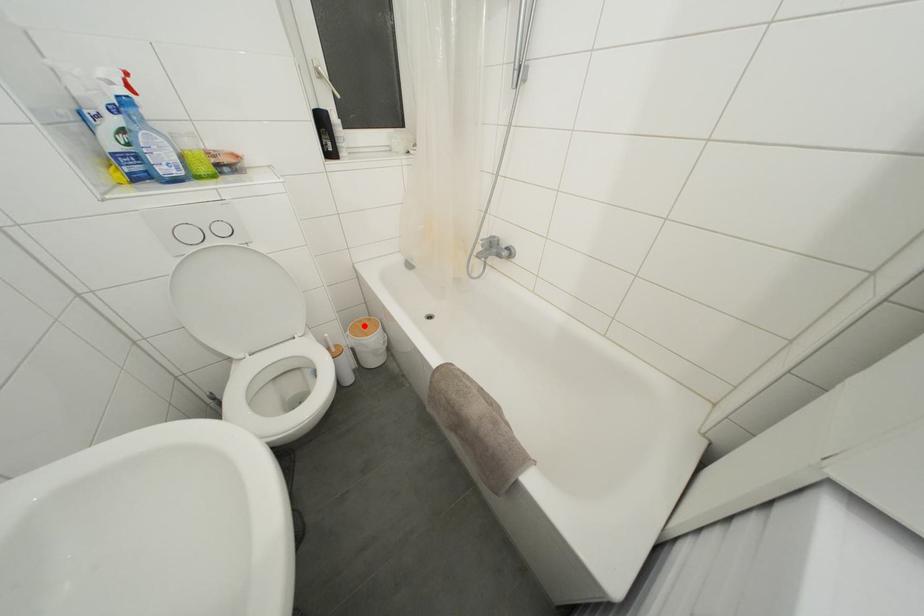
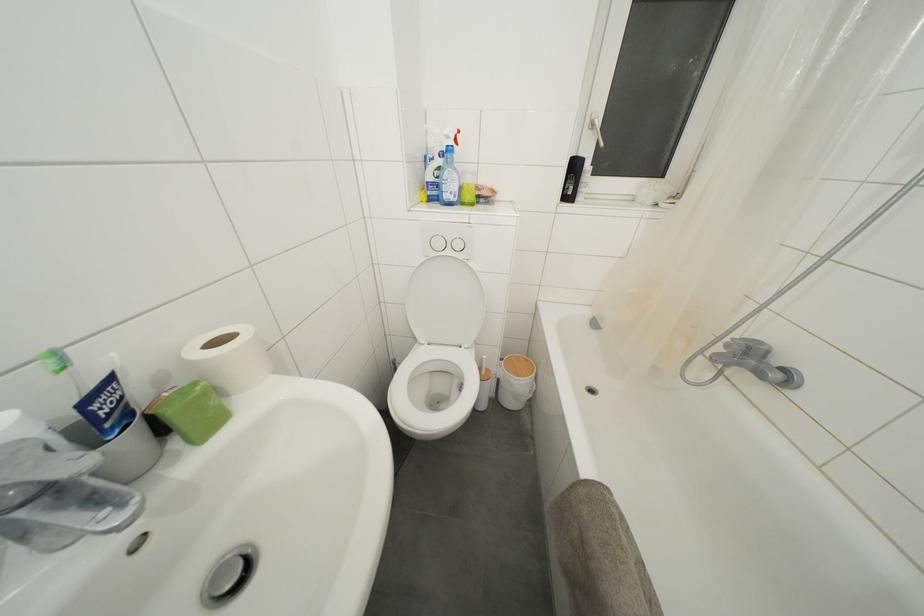
Question: I am providing you with two images of the same scene from different viewpoints. In image1, a red point is highlighted. Considering the same 3D point in image2, which of the following is correct?

Choices:
 (A) It is closer
 (B) It is farther

Answer: (B)